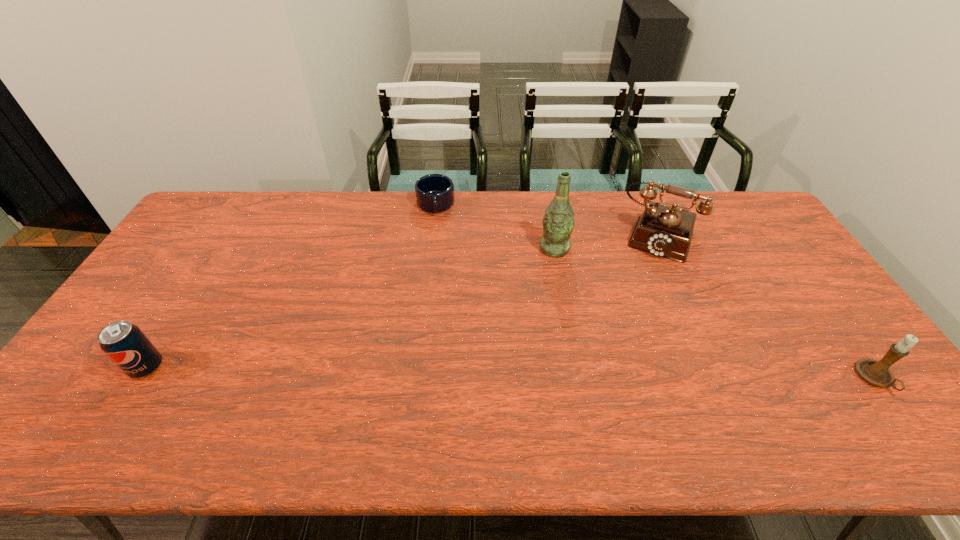
Find the location of `the leftmost object`. the leftmost object is located at coordinates [125, 344].

Find the location of a particular element. The image size is (960, 540). candle holder is located at coordinates (878, 373).

Where is `telephone`? telephone is located at coordinates (664, 231).

This screenshot has width=960, height=540. What are the coordinates of `the fourth object from left to right` in the screenshot? It's located at (664, 231).

Where is `beer bottle`? The image size is (960, 540). beer bottle is located at coordinates (558, 222).

At what (x,y) coordinates should I click in order to perform the action: click on the tallest object. Please return your answer as a coordinate pair (x, y). The image size is (960, 540). Looking at the image, I should click on click(x=558, y=222).

At what (x,y) coordinates should I click in order to perform the action: click on mug. Please return your answer as a coordinate pair (x, y). The height and width of the screenshot is (540, 960). Looking at the image, I should click on (434, 193).

Image resolution: width=960 pixels, height=540 pixels. Identify the location of the shortest object. (434, 193).

The height and width of the screenshot is (540, 960). Find the location of `vacant region located 0.340m on the right of the soda can`. vacant region located 0.340m on the right of the soda can is located at coordinates (298, 367).

At what (x,y) coordinates should I click in order to perform the action: click on free point located 0.140m on the dial of the second object from right to left. Please return your answer as a coordinate pair (x, y). The height and width of the screenshot is (540, 960). Looking at the image, I should click on (642, 288).